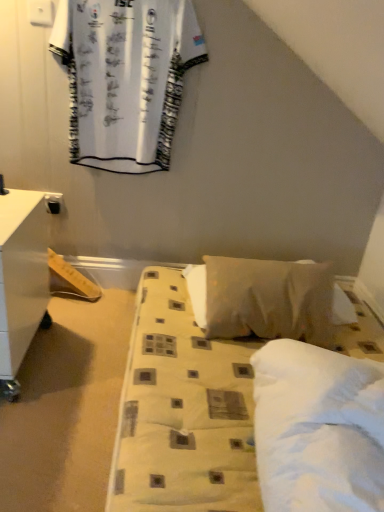
Measure the distance between white printed fabric at upper left and camera.

white printed fabric at upper left and camera are 1.59 meters apart from each other.

Identify the location of white soft pillow at center. The image size is (384, 512). (262, 298).

In the scene shown: In order to face white fabric bed at center, should I rotate leftwards or rightwards?

Turn right approximately 2.005 degrees to face it.

Locate an element on the screen. white fabric bed at center is located at coordinates (183, 411).

Find the location of a particular element. The height and width of the screenshot is (512, 384). white printed fabric at upper left is located at coordinates (125, 78).

From the image's perspective, which is above, white printed fabric at upper left or white soft pillow at center?

white printed fabric at upper left appears higher in the image.

Does white printed fabric at upper left turn towards white soft pillow at center?

No, white printed fabric at upper left is not aimed at white soft pillow at center.

Considering the points (167, 127) and (279, 302), which point is behind, point (167, 127) or point (279, 302)?

Point (167, 127)

Considering their positions, is white printed fabric at upper left located in front of or behind white soft pillow at center?

white printed fabric at upper left is behind white soft pillow at center.

Between white fabric bed at center and white soft pillow at center, which one is positioned behind?

white soft pillow at center.

From the image's perspective, is white fabric bed at center above or below white soft pillow at center?

Based on their image positions, white fabric bed at center is located beneath white soft pillow at center.

Considering the sizes of objects white fabric bed at center and white soft pillow at center in the image provided, who is shorter, white fabric bed at center or white soft pillow at center?

white fabric bed at center.

Does white glossy nightstand at left have a greater width compared to white printed fabric at upper left?

Indeed, white glossy nightstand at left has a greater width compared to white printed fabric at upper left.

Which is more to the right, white glossy nightstand at left or white printed fabric at upper left?

white printed fabric at upper left.

The image size is (384, 512). I want to click on curtain lying behind the white glossy nightstand at left, so [x=125, y=78].

Is white glossy nightstand at left turned away from white printed fabric at upper left?

That's not correct — white glossy nightstand at left is not looking away from white printed fabric at upper left.

From the image's perspective, would you say white printed fabric at upper left is positioned over white fabric bed at center?

Yes.

What's the angular difference between white printed fabric at upper left and white fabric bed at center's facing directions?

The facing directions of white printed fabric at upper left and white fabric bed at center are 0.945 degrees apart.

Identify the location of curtain above the white fabric bed at center (from the image's perspective). The height and width of the screenshot is (512, 384). (125, 78).

From a real-world perspective, which is physically below, white soft pillow at center or white glossy nightstand at left?

From a 3D spatial view, white soft pillow at center is below.

Which is in front, white soft pillow at center or white glossy nightstand at left?

white glossy nightstand at left is in front.

Based on the photo, from the image's perspective, which one is positioned lower, white soft pillow at center or white glossy nightstand at left?

white soft pillow at center.

From the picture: Which of these two, white fabric bed at center or white glossy nightstand at left, is smaller?

With smaller size is white glossy nightstand at left.

Is there a large distance between white fabric bed at center and white glossy nightstand at left?

They are positioned close to each other.

Considering the positions of objects white fabric bed at center and white glossy nightstand at left in the image provided, who is behind, white fabric bed at center or white glossy nightstand at left?

white glossy nightstand at left is further from the camera.

From the image's perspective, is white fabric bed at center over white glossy nightstand at left?

Incorrect, from the image's perspective, white fabric bed at center is lower than white glossy nightstand at left.

From the image's perspective, relative to white soft pillow at center, is white glossy nightstand at left above or below?

white glossy nightstand at left is above white soft pillow at center.

From a real-world perspective, is white glossy nightstand at left positioned under white soft pillow at center based on gravity?

No, from a real-world perspective, white glossy nightstand at left is not under white soft pillow at center.

Can you confirm if white glossy nightstand at left is wider than white soft pillow at center?

Yes.

Considering the relative sizes of white glossy nightstand at left and white soft pillow at center in the image provided, is white glossy nightstand at left taller than white soft pillow at center?

Indeed, white glossy nightstand at left has a greater height compared to white soft pillow at center.

Where is `curtain on the left side of white soft pillow at center`? This screenshot has width=384, height=512. curtain on the left side of white soft pillow at center is located at coordinates (125, 78).

Where is `bed below the white soft pillow at center (from the image's perspective)`? The image size is (384, 512). bed below the white soft pillow at center (from the image's perspective) is located at coordinates (183, 411).

Looking at the image, which one is located closer to white fabric bed at center, white soft pillow at center or white printed fabric at upper left?

Based on the image, white soft pillow at center appears to be nearer to white fabric bed at center.

Which object lies further to the anchor point white glossy nightstand at left, white fabric bed at center or white printed fabric at upper left?

Based on the image, white printed fabric at upper left appears to be further to white glossy nightstand at left.

Looking at the image, which one is located further to white fabric bed at center, white printed fabric at upper left or white soft pillow at center?

white printed fabric at upper left is positioned further to the anchor white fabric bed at center.

Based on their spatial positions, is white soft pillow at center or white fabric bed at center closer to white glossy nightstand at left?

Based on the image, white fabric bed at center appears to be nearer to white glossy nightstand at left.

Consider the image. When comparing their distances from white glossy nightstand at left, does white soft pillow at center or white printed fabric at upper left seem further?

Among the two, white soft pillow at center is located further to white glossy nightstand at left.

Looking at the image, which one is located further to white glossy nightstand at left, white fabric bed at center or white soft pillow at center?

Among the two, white soft pillow at center is located further to white glossy nightstand at left.

Considering their positions, is white glossy nightstand at left positioned further to white printed fabric at upper left than white soft pillow at center?

white soft pillow at center lies further to white printed fabric at upper left than the other object.

Considering their positions, is white fabric bed at center positioned further to white printed fabric at upper left than white soft pillow at center?

white fabric bed at center is further to white printed fabric at upper left.

Identify the location of pillow between white printed fabric at upper left and white fabric bed at center in the up-down direction. The width and height of the screenshot is (384, 512). (262, 298).

What are the coordinates of `curtain located between white glossy nightstand at left and white soft pillow at center in the left-right direction` in the screenshot? It's located at (125, 78).

Locate an element on the screen. The image size is (384, 512). bed between white glossy nightstand at left and white soft pillow at center from left to right is located at coordinates (x=183, y=411).

Identify the location of nightstand between white printed fabric at upper left and white fabric bed at center in the vertical direction. (21, 279).